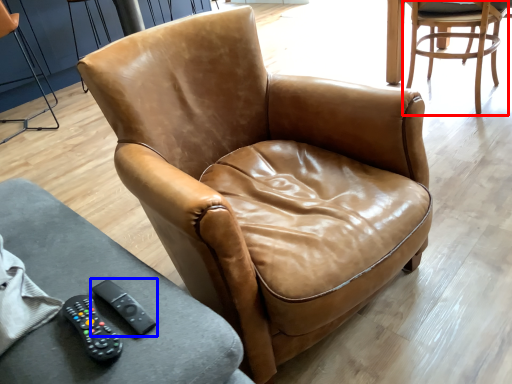
Question: Which point is closer to the camera, chair (highlighted by a red box) or remote (highlighted by a blue box)?

Choices:
 (A) chair
 (B) remote

Answer: (B)